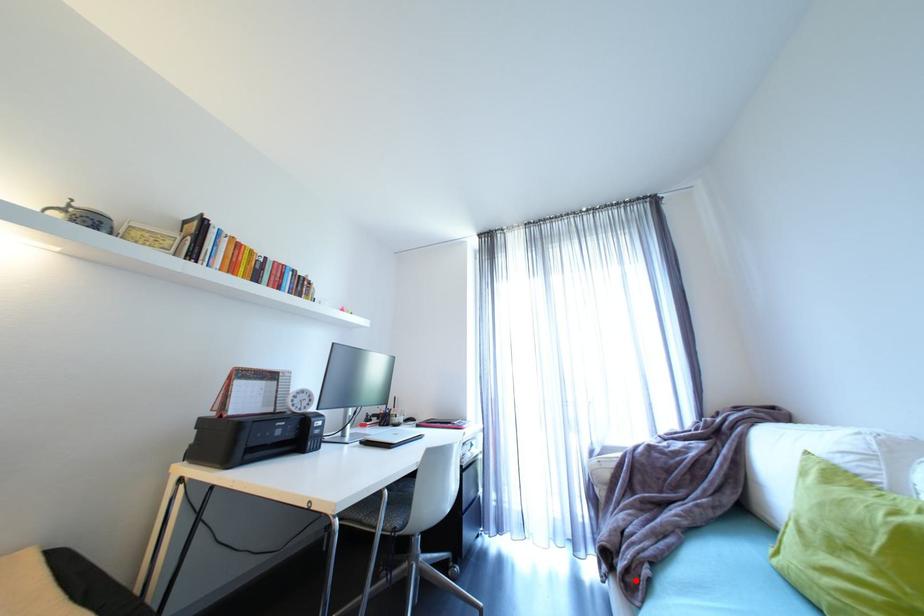
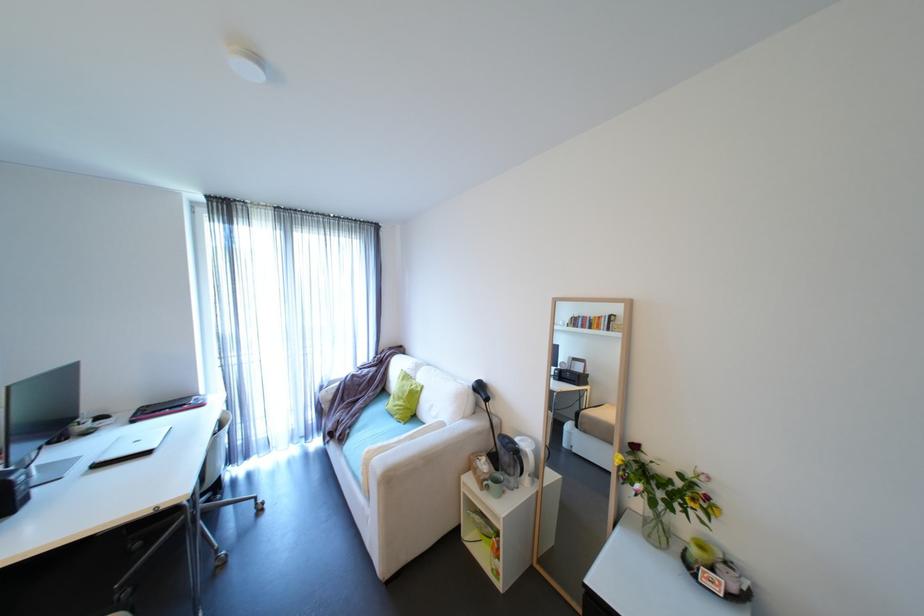
The point at the highlighted location is marked in the first image. Where is the corresponding point in the second image?

(347, 438)